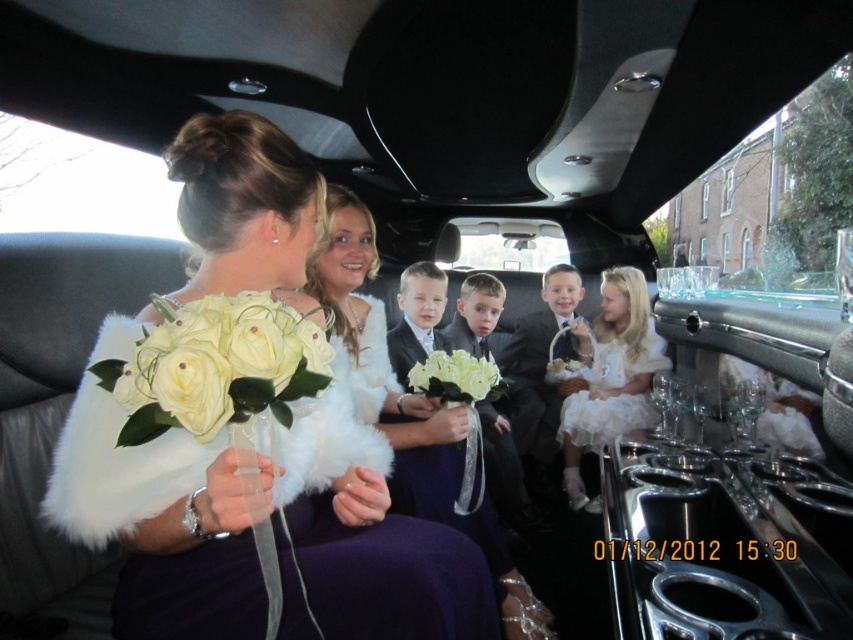
Question: Where is matte black suit at center located in relation to white fluffy rose at center in the image?

Choices:
 (A) below
 (B) above

Answer: (A)

Question: Does white silk bouquet at center have a larger size compared to white lace dress at center?

Choices:
 (A) yes
 (B) no

Answer: (B)

Question: Which of the following is the closest to the observer?

Choices:
 (A) (622, 397)
 (B) (361, 330)
 (C) (131, 424)
 (D) (228, 403)

Answer: (D)

Question: Which object is closer to the camera taking this photo?

Choices:
 (A) white lace dress at center
 (B) matte black suit at center
 (C) white fluffy rose at center

Answer: (C)

Question: Does matte black suit at center come behind white fluffy rose at center?

Choices:
 (A) no
 (B) yes

Answer: (B)

Question: Which of the following is the closest to the observer?

Choices:
 (A) white lace dress at center
 (B) matte black suit at center

Answer: (A)